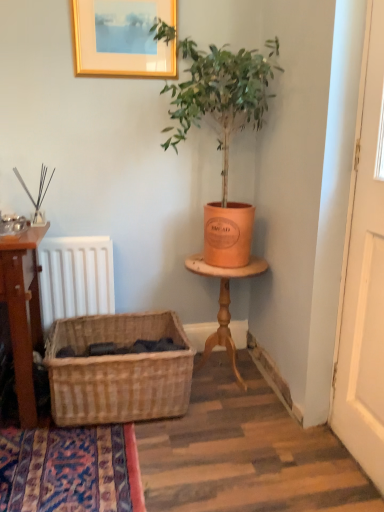
Image resolution: width=384 pixels, height=512 pixels. I want to click on free spot to the left of white wooden door at right, so tap(316, 464).